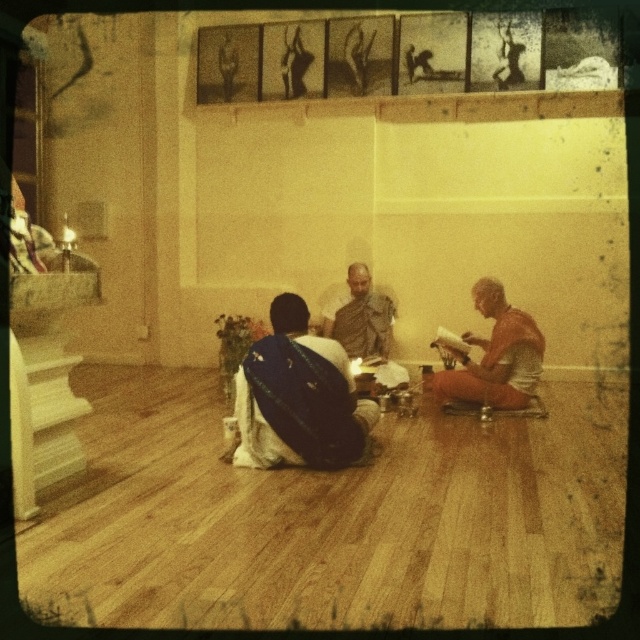
Question: Can you confirm if blue silk saree at center is thinner than orange cotton cloth at right?

Choices:
 (A) no
 (B) yes

Answer: (A)

Question: Is blue silk saree at center above orange cotton cloth at right?

Choices:
 (A) no
 (B) yes

Answer: (A)

Question: Which object is the closest to the blue silk saree at center?

Choices:
 (A) orange cotton cloth at right
 (B) matte brown robe at center

Answer: (A)

Question: Is blue silk saree at center above orange cotton cloth at right?

Choices:
 (A) yes
 (B) no

Answer: (B)

Question: Among these points, which one is farthest from the camera?

Choices:
 (A) (276, 368)
 (B) (444, 378)
 (C) (356, 275)

Answer: (C)

Question: Which of these objects is positioned farthest from the blue silk saree at center?

Choices:
 (A) matte brown robe at center
 (B) orange cotton cloth at right

Answer: (A)